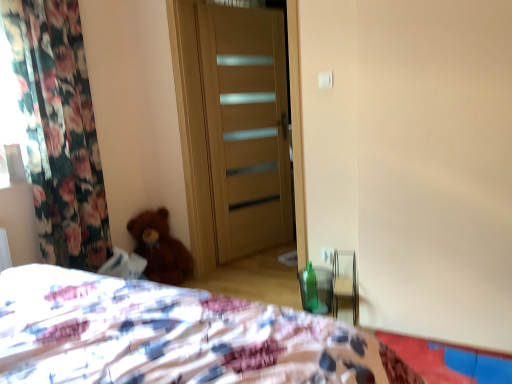
This screenshot has height=384, width=512. What do you see at coordinates (172, 336) in the screenshot? I see `fluffy fabric bed at lower left` at bounding box center [172, 336].

Identify the location of brown plush teddy bear at lower left. The height and width of the screenshot is (384, 512). (160, 248).

Identify the location of fluffy fabric bed at lower left. The image size is (512, 384). (172, 336).

From the image's perspective, is fluffy fabric bed at lower left above or below brown plush teddy bear at lower left?

Clearly, from the image's perspective, fluffy fabric bed at lower left is below brown plush teddy bear at lower left.

Does fluffy fabric bed at lower left turn towards brown plush teddy bear at lower left?

Yes, fluffy fabric bed at lower left faces towards brown plush teddy bear at lower left.

Does point (117, 360) lie in front of point (147, 221)?

Yes, it is in front of point (147, 221).

Is fluffy fabric bed at lower left taller than brown plush teddy bear at lower left?

Indeed, fluffy fabric bed at lower left has a greater height compared to brown plush teddy bear at lower left.

From a real-world perspective, between brown plush teddy bear at lower left and green glass bottle at lower right, who is vertically lower?

In real-world perspective, green glass bottle at lower right is lower.

Can you confirm if brown plush teddy bear at lower left is shorter than green glass bottle at lower right?

In fact, brown plush teddy bear at lower left may be taller than green glass bottle at lower right.

Based on the photo, from the image's perspective, is brown plush teddy bear at lower left positioned above or below green glass bottle at lower right?

brown plush teddy bear at lower left is situated higher than green glass bottle at lower right in the image.

Between point (202, 41) and point (303, 273), which one is positioned behind?

The point (202, 41) is farther.

Which object is wider, light brown wood door at center or green glass bottle at lower right?

Wider between the two is light brown wood door at center.

From a real-world perspective, is light brown wood door at center physically located above or below green glass bottle at lower right?

light brown wood door at center is above green glass bottle at lower right.

Which object is more forward, light brown wood door at center or green glass bottle at lower right?

green glass bottle at lower right is in front.

Based on the photo, from a real-world perspective, which object rests below the other?

In real-world perspective, brown plush teddy bear at lower left is lower.

Which is more to the left, light brown wood door at center or brown plush teddy bear at lower left?

brown plush teddy bear at lower left is more to the left.

Which of these two, light brown wood door at center or brown plush teddy bear at lower left, is thinner?

light brown wood door at center is thinner.

Is the position of brown plush teddy bear at lower left more distant than that of fluffy fabric bed at lower left?

Yes, it is.

Which is closer, (x=151, y=232) or (x=45, y=364)?

The point (x=45, y=364) is more forward.

Visually, is brown plush teddy bear at lower left positioned to the left or to the right of fluffy fabric bed at lower left?

Based on their positions, brown plush teddy bear at lower left is located to the left of fluffy fabric bed at lower left.

How much distance is there between brown plush teddy bear at lower left and fluffy fabric bed at lower left?

5.39 feet.

Is light brown wood door at center surrounded by green glass bottle at lower right?

No, light brown wood door at center is not inside green glass bottle at lower right.

Does green glass bottle at lower right touch light brown wood door at center?

green glass bottle at lower right and light brown wood door at center are clearly separated.

Could you tell me if green glass bottle at lower right is facing light brown wood door at center?

No, green glass bottle at lower right is not turned towards light brown wood door at center.

Which of these two, green glass bottle at lower right or light brown wood door at center, is thinner?

green glass bottle at lower right.

Which object is closer to the camera taking this photo, brown plush teddy bear at lower left or light brown wood door at center?

brown plush teddy bear at lower left is more forward.

Can you confirm if brown plush teddy bear at lower left is bigger than light brown wood door at center?

No.

Can you confirm if brown plush teddy bear at lower left is positioned to the left of light brown wood door at center?

Yes, brown plush teddy bear at lower left is to the left of light brown wood door at center.

Is brown plush teddy bear at lower left inside or outside of light brown wood door at center?

brown plush teddy bear at lower left exists outside the volume of light brown wood door at center.

Image resolution: width=512 pixels, height=384 pixels. I want to click on bed below the brown plush teddy bear at lower left (from the image's perspective), so click(x=172, y=336).

Locate an element on the screen. This screenshot has width=512, height=384. teddy bear above the green glass bottle at lower right (from the image's perspective) is located at coordinates (160, 248).

Which object lies further to the anchor point light brown wood door at center, green glass bottle at lower right or fluffy fabric bed at lower left?

fluffy fabric bed at lower left is further to light brown wood door at center.

Based on their spatial positions, is brown plush teddy bear at lower left or light brown wood door at center further from fluffy fabric bed at lower left?

light brown wood door at center is further to fluffy fabric bed at lower left.

When comparing their distances from green glass bottle at lower right, does brown plush teddy bear at lower left or light brown wood door at center seem further?

Based on the image, light brown wood door at center appears to be further to green glass bottle at lower right.

Which object lies nearer to the anchor point fluffy fabric bed at lower left, green glass bottle at lower right or brown plush teddy bear at lower left?

green glass bottle at lower right lies closer to fluffy fabric bed at lower left than the other object.

Considering their positions, is brown plush teddy bear at lower left positioned further to light brown wood door at center than green glass bottle at lower right?

Based on the image, green glass bottle at lower right appears to be further to light brown wood door at center.

Estimate the real-world distances between objects in this image. Which object is closer to fluffy fabric bed at lower left, light brown wood door at center or green glass bottle at lower right?

green glass bottle at lower right lies closer to fluffy fabric bed at lower left than the other object.

Estimate the real-world distances between objects in this image. Which object is further from brown plush teddy bear at lower left, green glass bottle at lower right or fluffy fabric bed at lower left?

fluffy fabric bed at lower left lies further to brown plush teddy bear at lower left than the other object.

Based on the photo, considering their positions, is light brown wood door at center positioned further to fluffy fabric bed at lower left than brown plush teddy bear at lower left?

The object further to fluffy fabric bed at lower left is light brown wood door at center.

Identify the location of teddy bear located between fluffy fabric bed at lower left and light brown wood door at center in the depth direction. The height and width of the screenshot is (384, 512). (160, 248).

The height and width of the screenshot is (384, 512). What are the coordinates of `bottle between fluffy fabric bed at lower left and light brown wood door at center in the front-back direction` in the screenshot? It's located at (310, 288).

At what (x,y) coordinates should I click in order to perform the action: click on bottle between fluffy fabric bed at lower left and brown plush teddy bear at lower left along the z-axis. Please return your answer as a coordinate pair (x, y). The width and height of the screenshot is (512, 384). Looking at the image, I should click on (310, 288).

The width and height of the screenshot is (512, 384). Find the location of `door between brown plush teddy bear at lower left and green glass bottle at lower right from left to right`. door between brown plush teddy bear at lower left and green glass bottle at lower right from left to right is located at coordinates (246, 127).